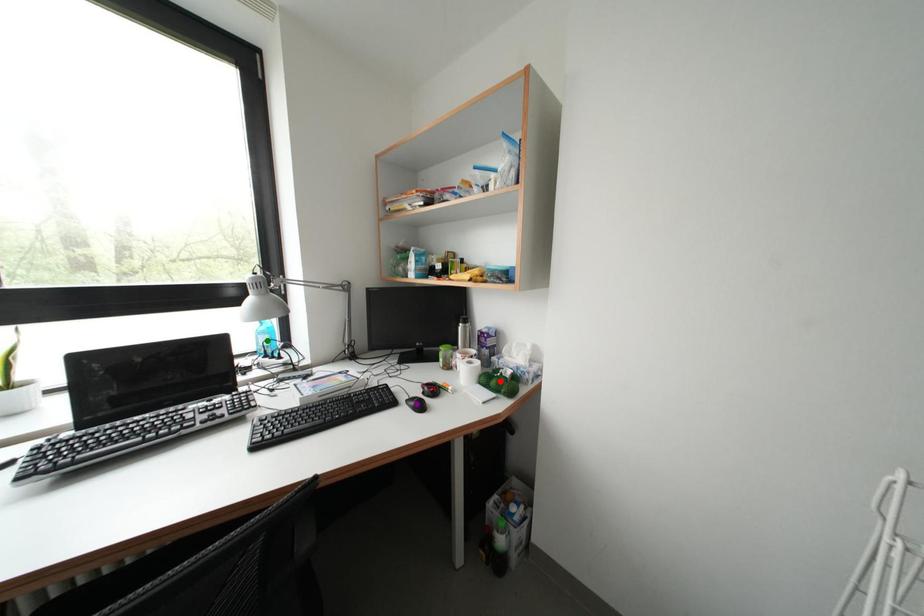
Order these from nearest to farthest:
- red point
- green point
- purple point

purple point, red point, green point